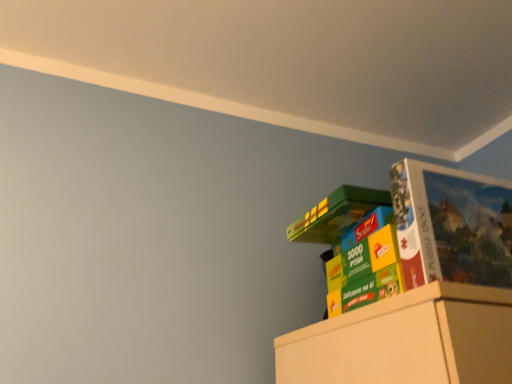
Question: Is matte cardboard puzzle at upper right smaller than multicolored cardboard puzzle box at upper right?

Choices:
 (A) yes
 (B) no

Answer: (A)

Question: Could you tell me if matte cardboard puzzle at upper right is facing multicolored cardboard puzzle box at upper right?

Choices:
 (A) no
 (B) yes

Answer: (A)

Question: Can you confirm if matte cardboard puzzle at upper right is bigger than multicolored cardboard puzzle box at upper right?

Choices:
 (A) yes
 (B) no

Answer: (B)

Question: From a real-world perspective, is matte cardboard puzzle at upper right physically below multicolored cardboard puzzle box at upper right?

Choices:
 (A) yes
 (B) no

Answer: (B)

Question: Considering the relative positions of matte cardboard puzzle at upper right and multicolored cardboard puzzle box at upper right in the image provided, is matte cardboard puzzle at upper right to the right of multicolored cardboard puzzle box at upper right from the viewer's perspective?

Choices:
 (A) yes
 (B) no

Answer: (A)

Question: Is multicolored cardboard puzzle box at upper right inside matte cardboard puzzle at upper right?

Choices:
 (A) yes
 (B) no

Answer: (B)

Question: Considering the relative sizes of multicolored cardboard puzzle box at upper right and matte cardboard puzzle at upper right in the image provided, is multicolored cardboard puzzle box at upper right taller than matte cardboard puzzle at upper right?

Choices:
 (A) no
 (B) yes

Answer: (B)

Question: Is the depth of multicolored cardboard puzzle box at upper right less than that of matte cardboard puzzle at upper right?

Choices:
 (A) no
 (B) yes

Answer: (A)

Question: From a real-world perspective, is multicolored cardboard puzzle box at upper right positioned over matte cardboard puzzle at upper right based on gravity?

Choices:
 (A) no
 (B) yes

Answer: (A)

Question: Can you confirm if multicolored cardboard puzzle box at upper right is bigger than matte cardboard puzzle at upper right?

Choices:
 (A) no
 (B) yes

Answer: (B)

Question: From the image's perspective, is multicolored cardboard puzzle box at upper right beneath matte cardboard puzzle at upper right?

Choices:
 (A) no
 (B) yes

Answer: (B)

Question: Could matte cardboard puzzle at upper right be considered to be inside multicolored cardboard puzzle box at upper right?

Choices:
 (A) no
 (B) yes

Answer: (A)

Question: In the image, is multicolored cardboard puzzle box at upper right positioned in front of or behind matte cardboard puzzle at upper right?

Choices:
 (A) front
 (B) behind

Answer: (B)